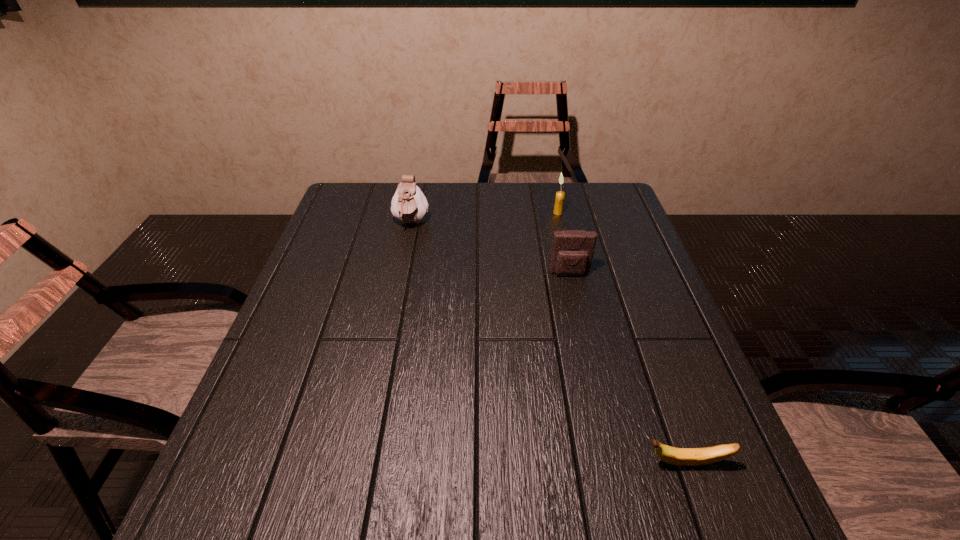
Locate an element on the screen. This screenshot has width=960, height=540. vacant space at the far left corner of the desktop is located at coordinates (382, 191).

Identify the location of vacant area at the near left corner of the desktop. (290, 514).

The image size is (960, 540). Identify the location of vacant area that lies between the candle and the leftmost object. (485, 218).

At what (x,y) coordinates should I click in order to perform the action: click on free space that is in between the leftmost object and the candle. Please return your answer as a coordinate pair (x, y). The height and width of the screenshot is (540, 960). Looking at the image, I should click on (485, 218).

Where is `unoccupied position between the banana and the farther pouch`? Image resolution: width=960 pixels, height=540 pixels. unoccupied position between the banana and the farther pouch is located at coordinates (548, 343).

Identify the location of vacant point located between the leftmost object and the right pouch. (491, 249).

Image resolution: width=960 pixels, height=540 pixels. In order to click on free space between the shortest object and the leftmost object in this screenshot , I will do `click(548, 343)`.

I want to click on free space between the nearer pouch and the farther pouch, so click(491, 249).

Locate an element on the screen. The height and width of the screenshot is (540, 960). unoccupied area between the nearest object and the nearer pouch is located at coordinates (628, 368).

Locate an element on the screen. This screenshot has width=960, height=540. the third closest object relative to the farther pouch is located at coordinates (676, 456).